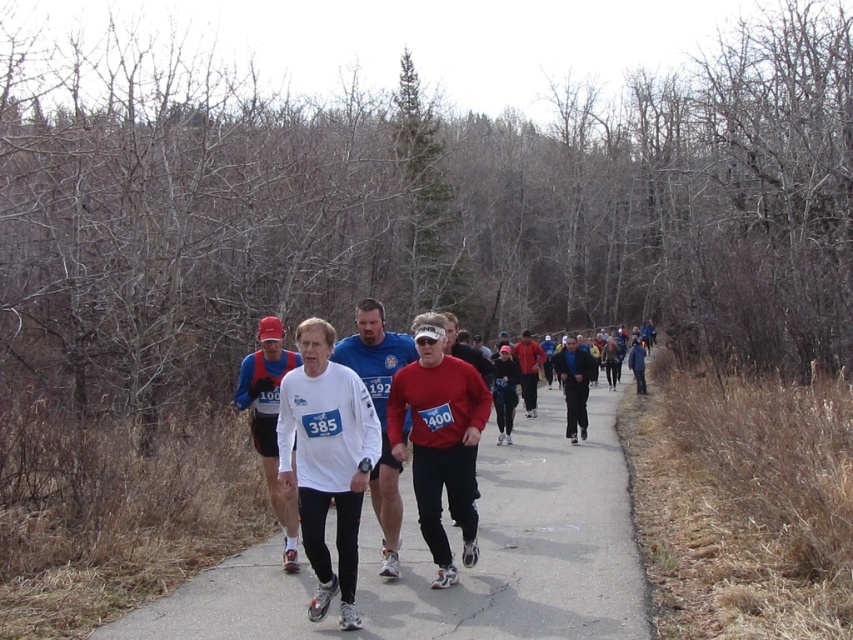
Which is more to the left, white matte long-sleeve shirt at center or white matte shirt at center?

From the viewer's perspective, white matte long-sleeve shirt at center appears more on the left side.

Which is above, white matte long-sleeve shirt at center or white matte shirt at center?

white matte long-sleeve shirt at center

You are a GUI agent. You are given a task and a screenshot of the screen. Output one action in this format:
    pyautogui.click(x=<x>, y=<y>)
    Task: Click on the white matte long-sleeve shirt at center
    Image resolution: width=853 pixels, height=640 pixels.
    Given the screenshot: What is the action you would take?
    pyautogui.click(x=328, y=460)

At what (x,y) coordinates should I click in order to perform the action: click on white matte long-sleeve shirt at center. Please return your answer as a coordinate pair (x, y). This screenshot has width=853, height=640. Looking at the image, I should click on (328, 460).

Which is below, white matte long-sleeve shirt at center or matte red shirt at center?

Positioned lower is white matte long-sleeve shirt at center.

Between point (282, 385) and point (474, 481), which one is positioned in front?

Positioned in front is point (282, 385).

Describe the element at coordinates (328, 460) in the screenshot. I see `white matte long-sleeve shirt at center` at that location.

Image resolution: width=853 pixels, height=640 pixels. In order to click on white matte long-sleeve shirt at center in this screenshot , I will do `click(328, 460)`.

Who is higher up, matte red long-sleeve shirt at center or matte red shirt at center?

matte red shirt at center

Who is more distant from viewer, (450, 461) or (454, 513)?

Point (454, 513)

The width and height of the screenshot is (853, 640). Identify the location of matte red long-sleeve shirt at center. (439, 440).

You are a GUI agent. You are given a task and a screenshot of the screen. Output one action in this format:
    pyautogui.click(x=<x>, y=<y>)
    Task: Click on the matte red long-sleeve shirt at center
    The width and height of the screenshot is (853, 640).
    Given the screenshot: What is the action you would take?
    pyautogui.click(x=439, y=440)